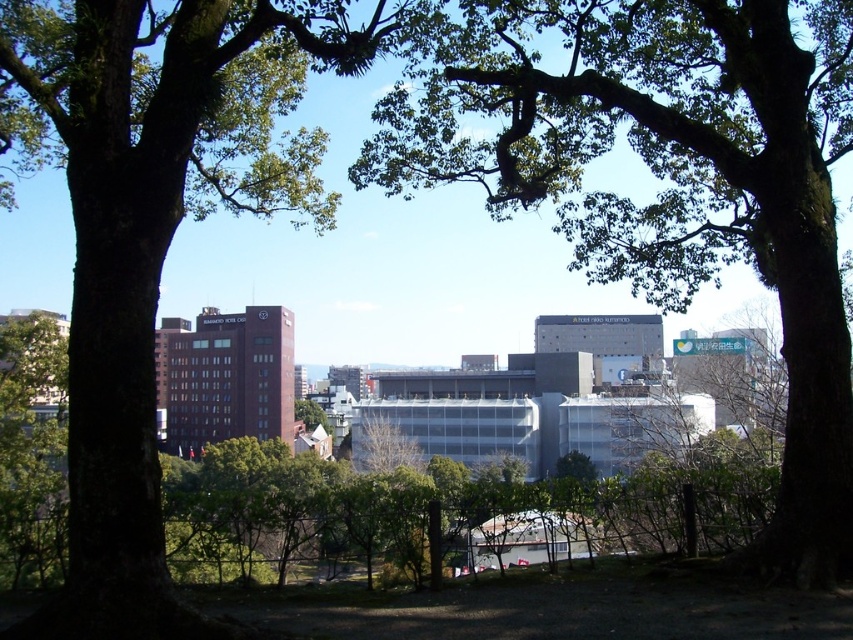
You are standing in the park and want to walk from point A to point B. Point A is at coordinate point (769, 163) and point B is at coordinate point (111, 502). Which point is closer to you when you start walking?

Point A at coordinate point (769, 163) is closer to you than point B at coordinate point (111, 502) because it is further to the viewer.

Looking at this image, you are standing at the point marked by the coordinates point (x=668, y=179) in the park. What can you see directly in front of you?

You can see a green leafy tree at center directly in front of you at the coordinates point (x=668, y=179).

You are standing at the camera position in the park scene. There is a point marked at coordinates point (662, 109). Can you estimate how far this point is from you?

The point (662, 109) is 7.69 meters away from the camera, so the distance is approximately 7.69 meters.